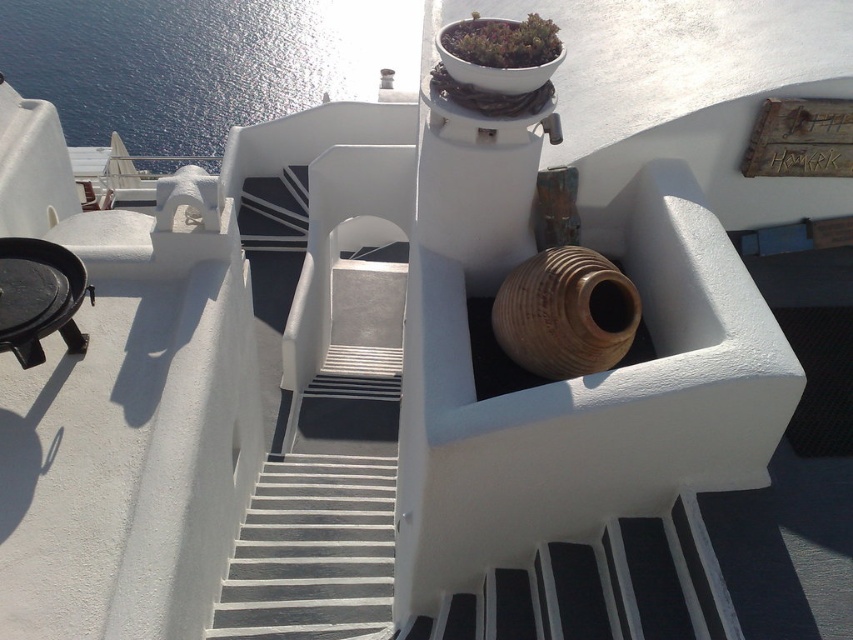
Question: Does blue water at upper left have a lesser width compared to green matte pot at upper center?

Choices:
 (A) yes
 (B) no

Answer: (B)

Question: Which object is farther from the camera taking this photo?

Choices:
 (A) blue water at upper left
 (B) green matte pot at upper center

Answer: (A)

Question: Which of the following is the closest to the observer?

Choices:
 (A) blue water at upper left
 (B) green matte pot at upper center

Answer: (B)

Question: Does blue water at upper left appear on the right side of green matte pot at upper center?

Choices:
 (A) yes
 (B) no

Answer: (B)

Question: Which point appears farthest from the camera in this image?

Choices:
 (A) (289, 44)
 (B) (442, 35)

Answer: (A)

Question: Is blue water at upper left to the left of green matte pot at upper center from the viewer's perspective?

Choices:
 (A) yes
 (B) no

Answer: (A)